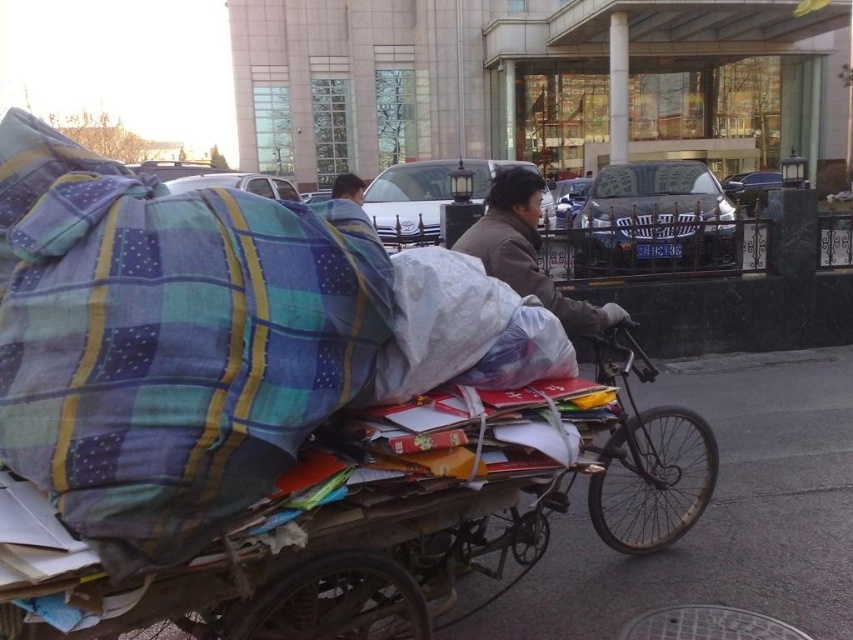
Is brown fuzzy coat at center shorter than dark brown hair at upper center?

Correct, brown fuzzy coat at center is not as tall as dark brown hair at upper center.

Can you confirm if brown fuzzy coat at center is positioned to the right of dark brown hair at upper center?

Correct, you'll find brown fuzzy coat at center to the right of dark brown hair at upper center.

Image resolution: width=853 pixels, height=640 pixels. What do you see at coordinates (526, 250) in the screenshot?
I see `brown fuzzy coat at center` at bounding box center [526, 250].

Locate an element on the screen. brown fuzzy coat at center is located at coordinates (526, 250).

Is point (700, 470) in front of point (354, 200)?

Yes.

Who is positioned more to the right, metallic silver bicycle at right or dark brown hair at upper center?

Positioned to the right is metallic silver bicycle at right.

The width and height of the screenshot is (853, 640). Describe the element at coordinates (646, 458) in the screenshot. I see `metallic silver bicycle at right` at that location.

Identify the location of metallic silver bicycle at right. (646, 458).

Between metallic silver bicycle at right and brown fuzzy coat at center, which one appears on the left side from the viewer's perspective?

Positioned to the left is brown fuzzy coat at center.

Between point (682, 435) and point (492, 253), which one is positioned behind?

Point (682, 435)

Between point (682, 528) and point (531, 237), which one is positioned behind?

Point (682, 528)

The image size is (853, 640). I want to click on metallic silver bicycle at right, so click(x=646, y=458).